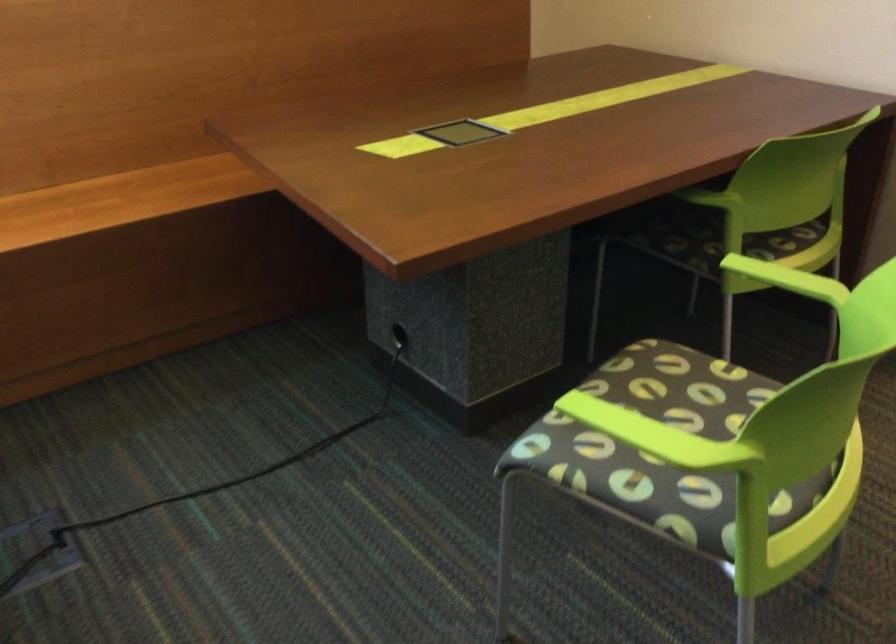
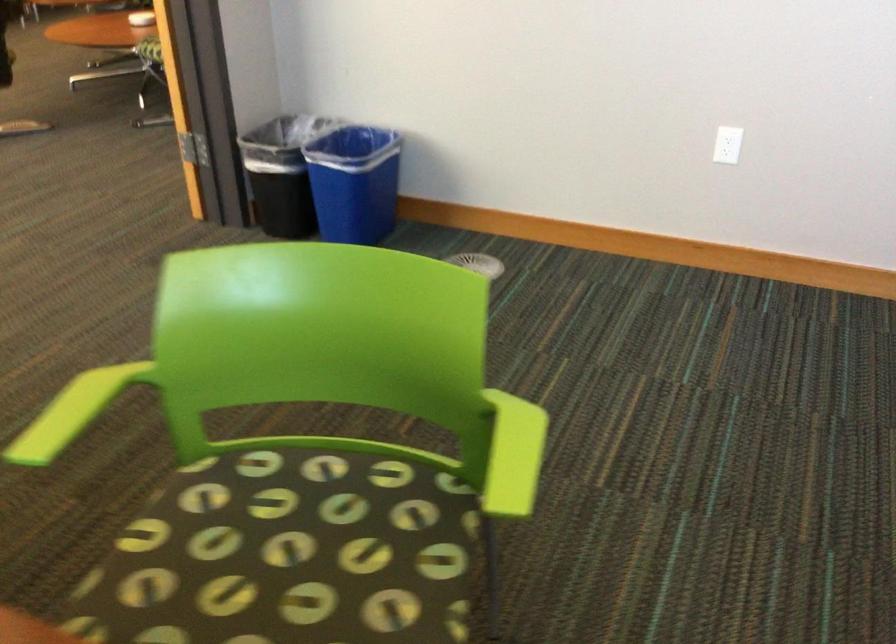
Locate, in the second image, the point that corresponds to [642,431] in the first image.

(513, 455)